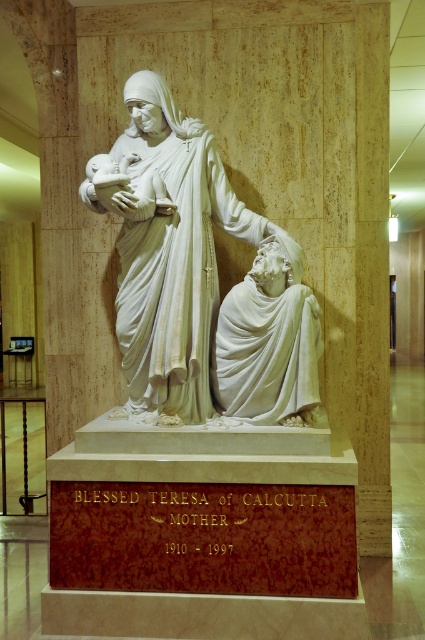
Can you confirm if white marble statue at center is bigger than white marble statue at lower right?

Yes, white marble statue at center is bigger than white marble statue at lower right.

Between point (129, 364) and point (251, 296), which one is positioned behind?

The point (129, 364) is more distant.

At what (x,y) coordinates should I click in order to perform the action: click on white marble statue at center. Please return your answer as a coordinate pair (x, y). The image size is (425, 640). Looking at the image, I should click on (167, 248).